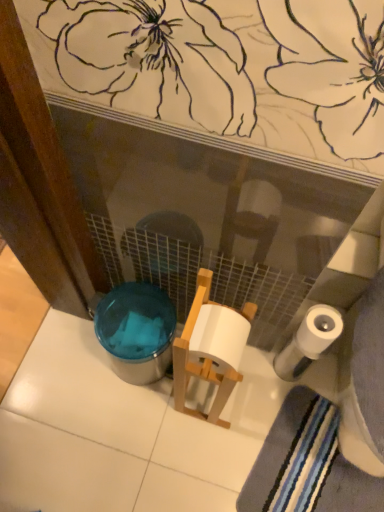
Find the location of a particular element. This screenshot has width=384, height=512. empty space that is ontop of translucent plastic potty at lower left (from a real-world perspective) is located at coordinates (135, 317).